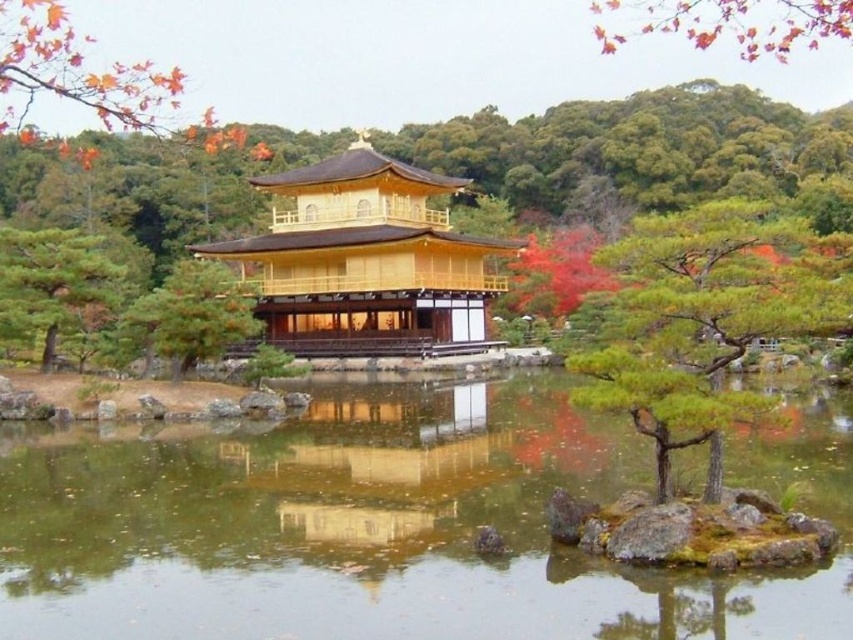
Based on the photo, is clear water at center thinner than green textured pine tree at center?

Yes.

Which is more to the right, clear water at center or green textured pine tree at center?

green textured pine tree at center is more to the right.

Describe the element at coordinates (389, 524) in the screenshot. I see `clear water at center` at that location.

Where is `clear water at center`? The image size is (853, 640). clear water at center is located at coordinates (x=389, y=524).

Is clear water at center in front of green textured tree at center?

Yes, clear water at center is closer to the viewer.

Can you confirm if clear water at center is thinner than green textured tree at center?

No, clear water at center is not thinner than green textured tree at center.

Who is more distant from viewer, (415, 483) or (206, 300)?

Positioned behind is point (206, 300).

Find the location of `clear water at center`. clear water at center is located at coordinates (389, 524).

Who is more distant from viewer, (x=74, y=248) or (x=166, y=284)?

The point (x=74, y=248) is more distant.

This screenshot has width=853, height=640. What do you see at coordinates (51, 284) in the screenshot?
I see `green textured pine tree at center-left` at bounding box center [51, 284].

You are a GUI agent. You are given a task and a screenshot of the screen. Output one action in this format:
    pyautogui.click(x=<x>, y=<y>)
    Task: Click on the green textured pine tree at center-left
    The image size is (853, 640).
    Given the screenshot: What is the action you would take?
    pyautogui.click(x=51, y=284)